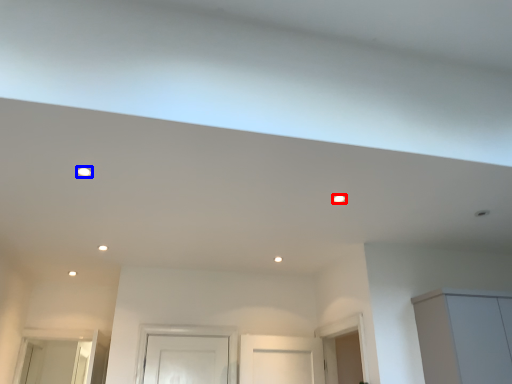
Question: Which point is further to the camera, lighting (highlighted by a red box) or lighting (highlighted by a blue box)?

Choices:
 (A) lighting
 (B) lighting

Answer: (A)